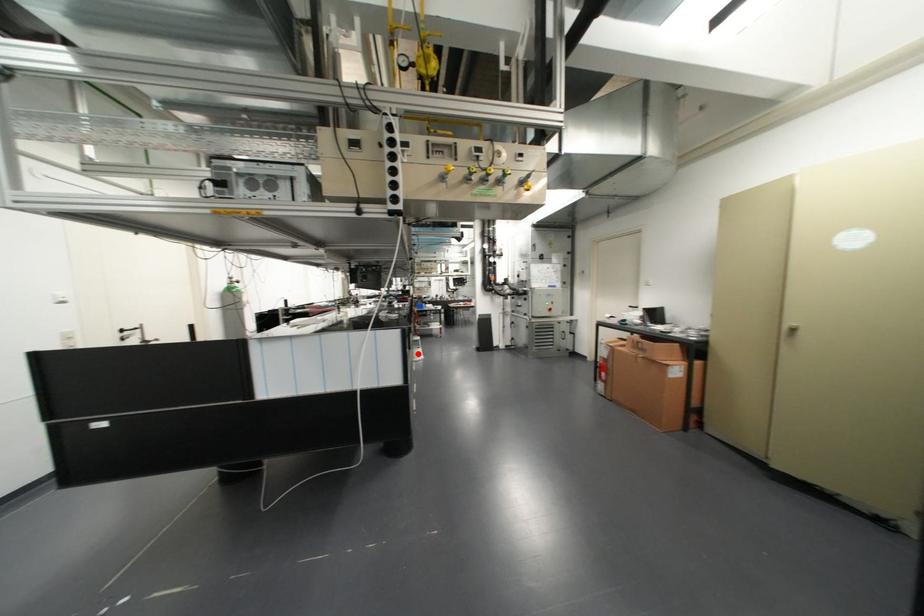
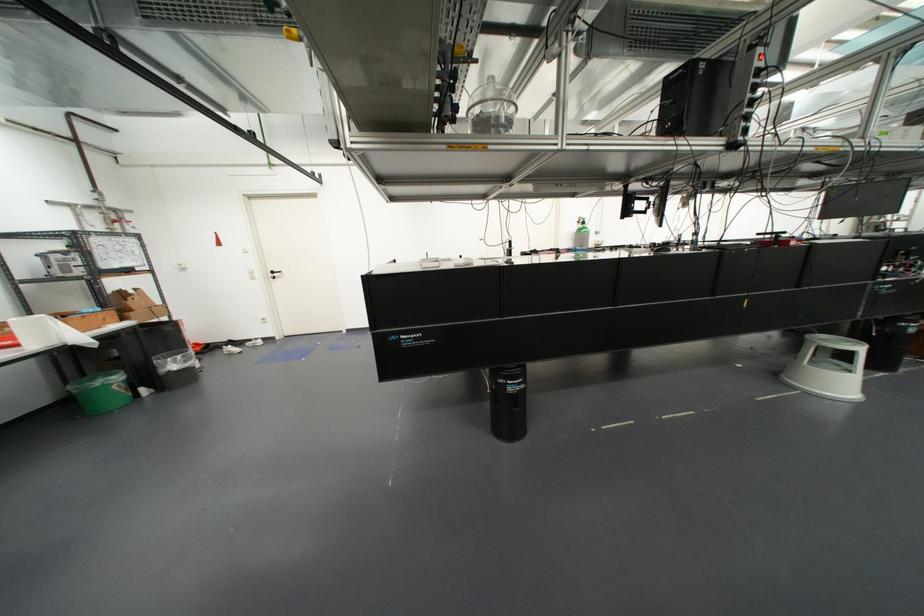
Question: I am providing you with two images of the same scene from different viewpoints. In image1, a red point is highlighted. Considering the same 3D point in image2, which of the following is correct?

Choices:
 (A) It is closer
 (B) It is farther

Answer: (A)